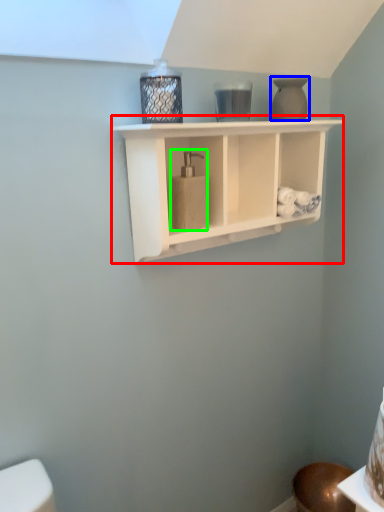
Question: Which object is the closest to the shelf (highlighted by a red box)? Choose among these: vase (highlighted by a blue box) or soap dispenser (highlighted by a green box).

Choices:
 (A) vase
 (B) soap dispenser

Answer: (B)